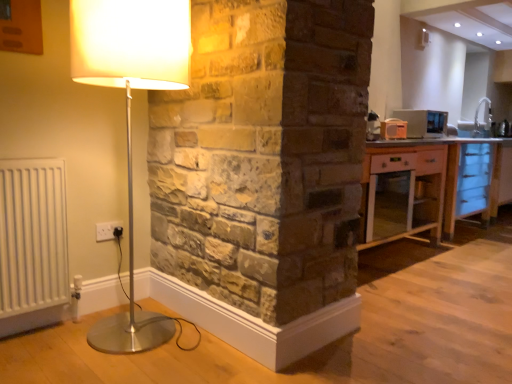
Question: Can you confirm if matte white lamp at left is positioned to the left of metallic silver microwave at upper right?

Choices:
 (A) yes
 (B) no

Answer: (A)

Question: Does matte white lamp at left touch metallic silver microwave at upper right?

Choices:
 (A) yes
 (B) no

Answer: (B)

Question: Does matte white lamp at left have a larger size compared to metallic silver microwave at upper right?

Choices:
 (A) no
 (B) yes

Answer: (B)

Question: From the image's perspective, is matte white lamp at left above metallic silver microwave at upper right?

Choices:
 (A) no
 (B) yes

Answer: (A)

Question: Is metallic silver microwave at upper right completely or partially inside matte white lamp at left?

Choices:
 (A) no
 (B) yes

Answer: (A)

Question: From the image's perspective, relative to metallic silver microwave at upper right, is matte white lamp at left above or below?

Choices:
 (A) below
 (B) above

Answer: (A)

Question: Considering the positions of matte white lamp at left and metallic silver microwave at upper right in the image, is matte white lamp at left wider or thinner than metallic silver microwave at upper right?

Choices:
 (A) wide
 (B) thin

Answer: (A)

Question: Based on their positions, is matte white lamp at left located to the left or right of metallic silver microwave at upper right?

Choices:
 (A) left
 (B) right

Answer: (A)

Question: Considering the positions of matte white lamp at left and metallic silver microwave at upper right in the image, is matte white lamp at left taller or shorter than metallic silver microwave at upper right?

Choices:
 (A) tall
 (B) short

Answer: (A)

Question: Looking at their shapes, would you say metallic silver microwave at upper right is wider or thinner than white ceramic sink at upper right?

Choices:
 (A) wide
 (B) thin

Answer: (A)

Question: From a real-world perspective, is metallic silver microwave at upper right physically located above or below white ceramic sink at upper right?

Choices:
 (A) below
 (B) above

Answer: (A)

Question: Is metallic silver microwave at upper right to the left or to the right of white ceramic sink at upper right in the image?

Choices:
 (A) right
 (B) left

Answer: (B)

Question: Does point (428, 135) appear closer or farther from the camera than point (457, 125)?

Choices:
 (A) farther
 (B) closer

Answer: (B)

Question: Relative to white ceramic sink at upper right, is light wood cabinet at right in front or behind?

Choices:
 (A) behind
 (B) front

Answer: (B)

Question: From a real-world perspective, is light wood cabinet at right above or below white ceramic sink at upper right?

Choices:
 (A) above
 (B) below

Answer: (B)